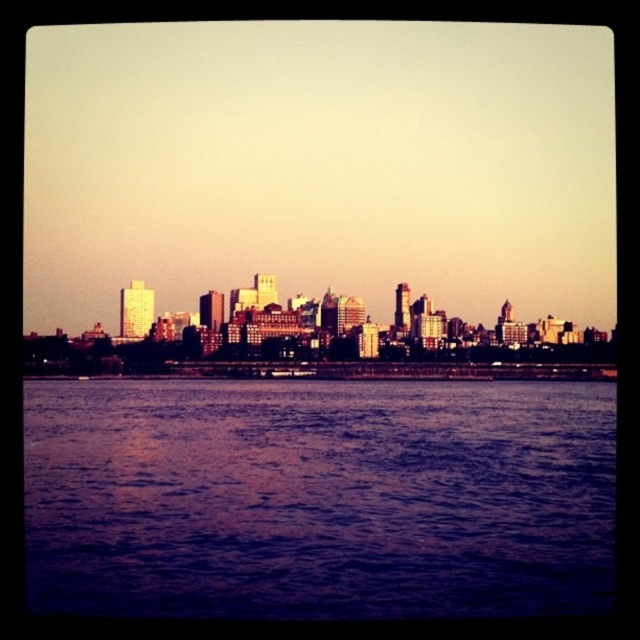
Question: Based on their relative distances, which object is nearer to the purple water at center?

Choices:
 (A) metallic silver boat at center
 (B) matte urban skyline at center

Answer: (B)

Question: Among these points, which one is farthest from the camera?

Choices:
 (A) (346, 506)
 (B) (301, 372)

Answer: (A)

Question: Which object appears closest to the camera in this image?

Choices:
 (A) matte urban skyline at center
 (B) purple water at center

Answer: (A)

Question: Does purple water at center have a smaller size compared to matte urban skyline at center?

Choices:
 (A) yes
 (B) no

Answer: (B)

Question: From the image, what is the correct spatial relationship of matte urban skyline at center in relation to metallic silver boat at center?

Choices:
 (A) below
 (B) above

Answer: (B)

Question: In this image, where is purple water at center located relative to matte urban skyline at center?

Choices:
 (A) above
 (B) below

Answer: (B)